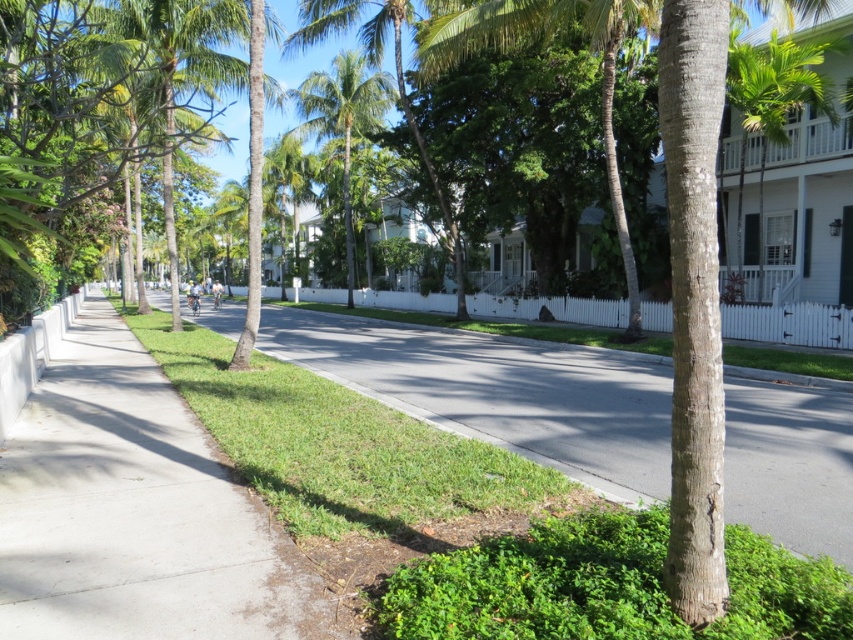
Does gray concrete sidewalk at center appear under green grass at lower left?

Yes.

Measure the distance from gray concrete sidewalk at center to green grass at lower left.

The distance of gray concrete sidewalk at center from green grass at lower left is 5.67 meters.

Is point (148, 374) positioned in front of point (788, 406)?

No, it is behind (788, 406).

You are a GUI agent. You are given a task and a screenshot of the screen. Output one action in this format:
    pyautogui.click(x=<x>, y=<y>)
    Task: Click on the gray concrete sidewalk at center
    
    Given the screenshot: What is the action you would take?
    pyautogui.click(x=136, y=513)

Is gray concrete sidewalk at center positioned before green leafy palm tree at upper right?

Yes.

Is gray concrete sidewalk at center shorter than green leafy palm tree at upper right?

No, gray concrete sidewalk at center is not shorter than green leafy palm tree at upper right.

Image resolution: width=853 pixels, height=640 pixels. What are the coordinates of `gray concrete sidewalk at center` in the screenshot? It's located at (136, 513).

Identify the location of gray concrete sidewalk at center. This screenshot has height=640, width=853. (136, 513).

Between green grass at lower left and green leafy palm tree at center, which one is positioned higher?

green leafy palm tree at center is higher up.

Between point (572, 458) and point (373, 76), which one is positioned in front?

Point (572, 458) is in front.

Does point (728, 442) come behind point (312, 120)?

No, (728, 442) is closer to viewer.

I want to click on green grass at lower left, so click(500, 394).